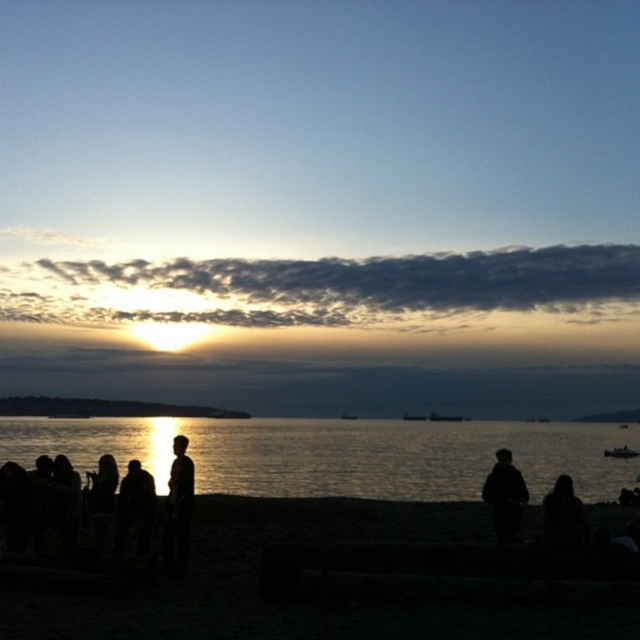
Can you confirm if dark matte jacket at center is shorter than metallic silver boat at lower right?

No, dark matte jacket at center is not shorter than metallic silver boat at lower right.

Between dark matte jacket at center and metallic silver boat at lower right, which one is positioned lower?

metallic silver boat at lower right

Is point (509, 502) positioned in front of point (605, 452)?

Yes.

This screenshot has width=640, height=640. What are the coordinates of `dark matte jacket at center` in the screenshot? It's located at (504, 497).

Between black sand at lower center and silhouette figure at lower right, which one has more height?

black sand at lower center

Can you confirm if black sand at lower center is thinner than silhouette figure at lower right?

In fact, black sand at lower center might be wider than silhouette figure at lower right.

Locate an element on the screen. black sand at lower center is located at coordinates (298, 596).

Does silhouette figure at lower right have a larger size compared to metallic silver boat at lower right?

No, silhouette figure at lower right is not bigger than metallic silver boat at lower right.

Who is taller, silhouette figure at lower right or metallic silver boat at lower right?

Standing taller between the two is silhouette figure at lower right.

Which is in front, point (570, 477) or point (625, 444)?

Positioned in front is point (570, 477).

Identify the location of silhouette figure at lower right. This screenshot has width=640, height=640. (563, 515).